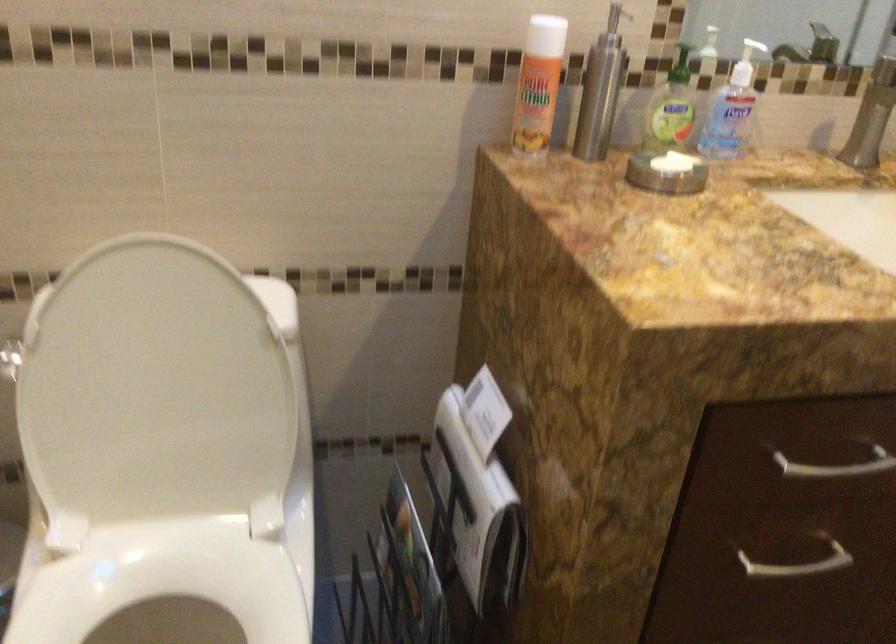
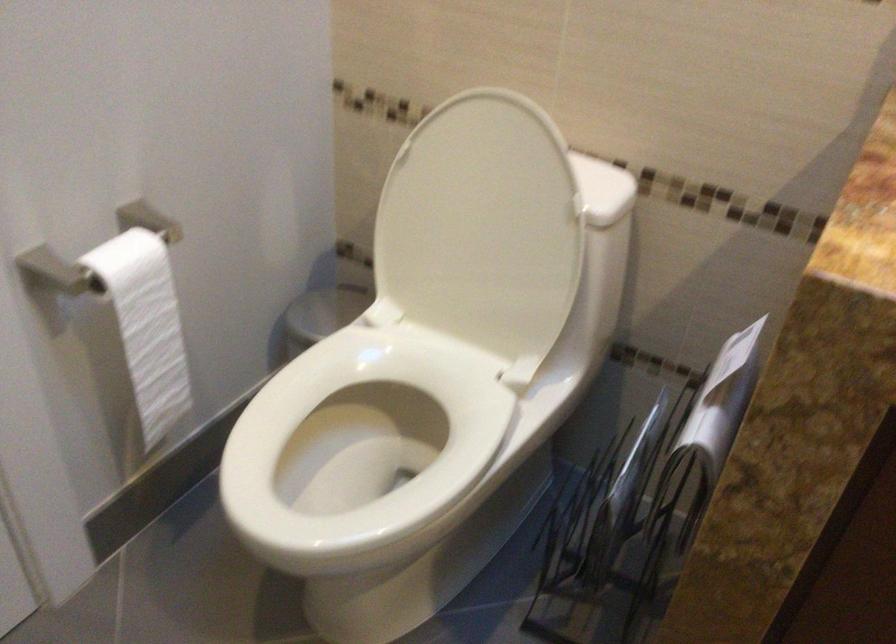
In the second image, find the point that corresponds to pixel 165 389 in the first image.

(483, 228)